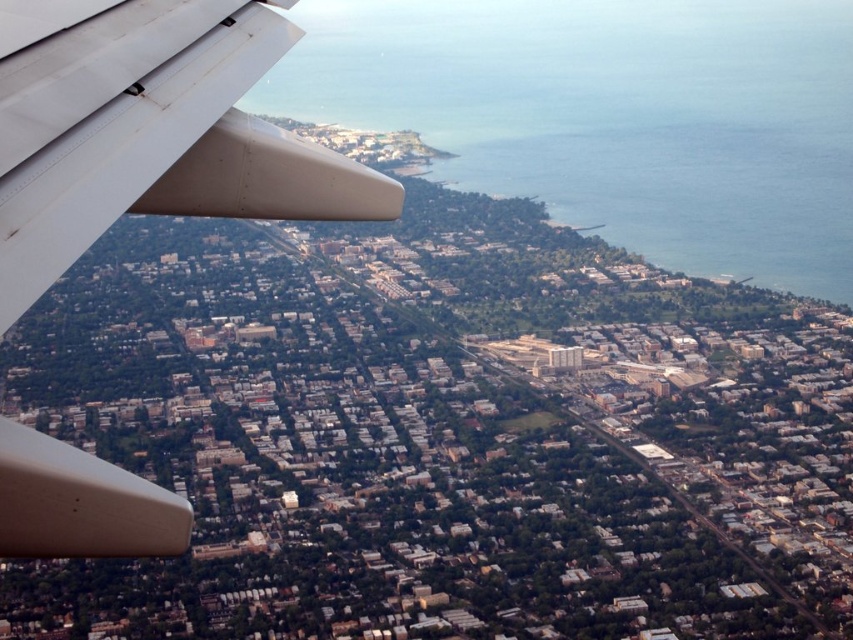
Consider the image. You are a passenger on the airplane and want to know if the blue water at lower right is visible above the white matte airplane wing at upper left. Can you see it?

The blue water at lower right is not as tall as the white matte airplane wing at upper left, so it cannot be seen above the wing.

You are a passenger on the airplane and looking out the window. You see the blue water at lower right and the white matte airplane wing at upper left. Which one is positioned higher in the image?

The blue water at lower right is located above the white matte airplane wing at upper left, so the blue water at lower right is positioned higher in the image.

As you look out the airplane window, you notice the blue water at lower right and the white matte airplane wing at upper left. Which of these two objects is positioned more to the right side of the window?

The blue water at lower right is positioned more to the right side of the window than the white matte airplane wing at upper left.